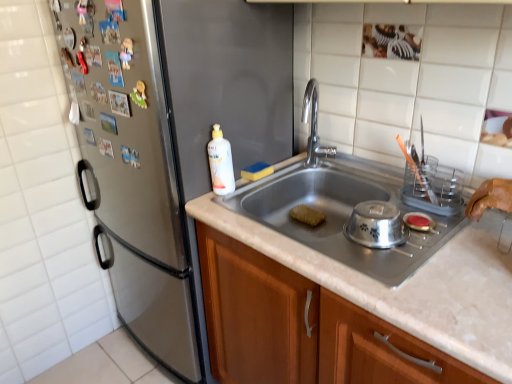
Question: In terms of height, does satin silver refrigerator at left look taller or shorter compared to brown sponge at sink center, which ranks as the first food in right-to-left order?

Choices:
 (A) tall
 (B) short

Answer: (A)

Question: Would you say satin silver refrigerator at left is to the left or to the right of brown sponge at sink center, acting as the first food starting from the bottom, in the picture?

Choices:
 (A) right
 (B) left

Answer: (B)

Question: Which object is the closest to the brown sponge at sink center, the 2th food viewed from the left?

Choices:
 (A) polished stainless steel faucet at center
 (B) white glossy bottle at center
 (C) silver metallic bowl at sink
 (D) yellow sponge at sink, the 1th food viewed from the top
 (E) wooden cabinet at center

Answer: (D)

Question: Estimate the real-world distances between objects in this image. Which object is closer to the silver metallic bowl at sink?

Choices:
 (A) satin silver refrigerator at left
 (B) polished stainless steel faucet at center
 (C) brown sponge at sink center, acting as the first food starting from the bottom
 (D) yellow sponge at sink, acting as the first food starting from the left
 (E) white glossy bottle at center

Answer: (C)